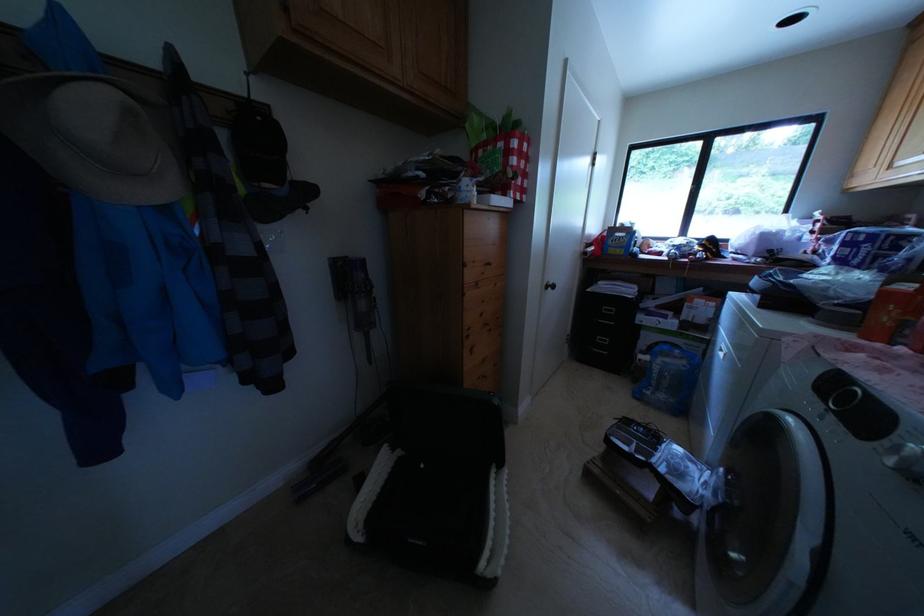
Find where to lift the red gift bag. Please return your answer as a coordinate pair (x, y).

(499, 152)